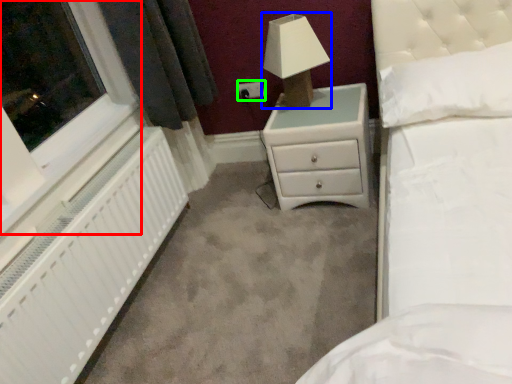
Question: Based on their relative distances, which object is farther from window (highlighted by a red box)? Choose from lamp (highlighted by a blue box) and electric outlet (highlighted by a green box).

Choices:
 (A) lamp
 (B) electric outlet

Answer: (B)